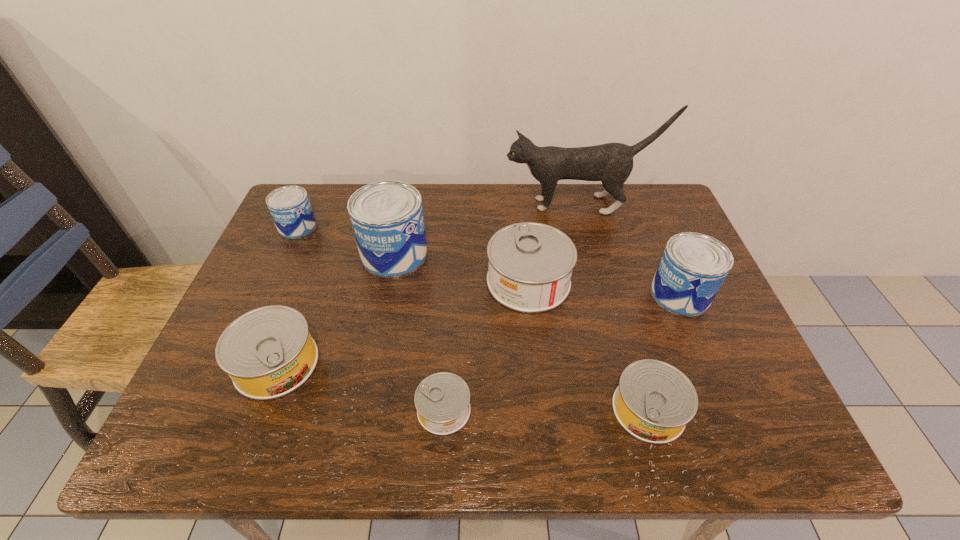
Locate an element on the screen. The width and height of the screenshot is (960, 540). free region at the far edge of the desktop is located at coordinates (349, 229).

Where is `vacant area at the left edge of the desktop`? Image resolution: width=960 pixels, height=540 pixels. vacant area at the left edge of the desktop is located at coordinates click(x=317, y=241).

Where is `free region at the right edge of the desktop`? The height and width of the screenshot is (540, 960). free region at the right edge of the desktop is located at coordinates (716, 313).

Where is `free region at the far left corner of the desktop`? free region at the far left corner of the desktop is located at coordinates (318, 214).

Find the location of a particular element. This screenshot has width=960, height=540. vacant position at the near left corner of the desktop is located at coordinates (182, 452).

Where is `free point between the tallest object and the leftmost silver can`? The image size is (960, 540). free point between the tallest object and the leftmost silver can is located at coordinates (428, 284).

Where is `empty space between the second biggest silver can and the biggest silver can`? empty space between the second biggest silver can and the biggest silver can is located at coordinates (402, 322).

Identify the location of empty location between the leftmost blue can and the second silver can from left to right. (371, 318).

I want to click on free area in between the fifth object from right to left and the third biggest silver can, so pyautogui.click(x=546, y=410).

Where is `empty space between the fifth can from left to right and the second can from right to left`? empty space between the fifth can from left to right and the second can from right to left is located at coordinates [588, 346].